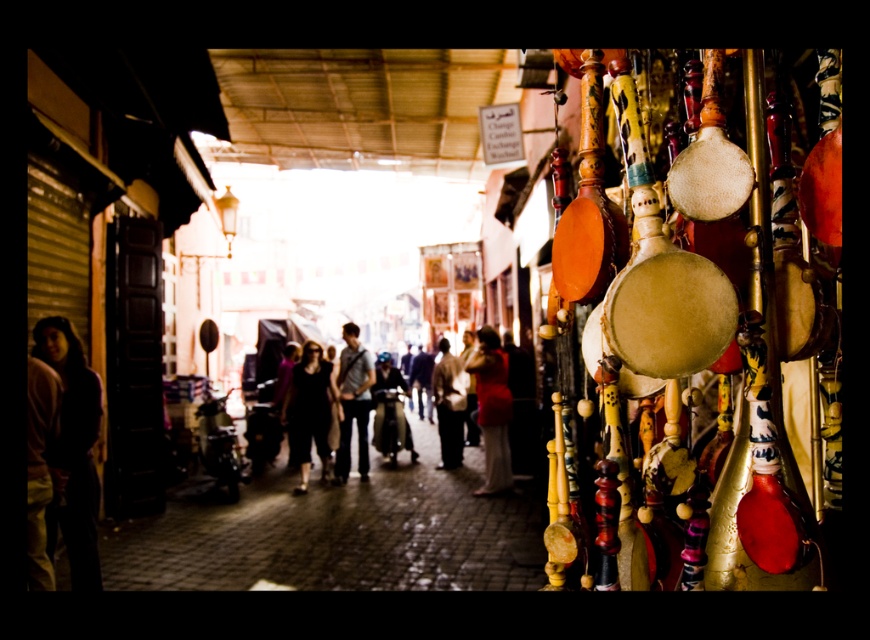
You are standing at the entrance of a market stall and want to reach a point that is 21.21 feet away. The point is marked as point (392, 579). Is this point located in the foreground or the midground of the scene?

The point (392, 579) is located in the midground of the scene because it is 21.21 feet away from the viewer, which places it beyond the foreground area where the musical instruments are displayed.

You are a customer in this market and you want to buy both the dark fabric pants at left and the dark matte clothing at center. Which item would you need to try on first if you want to check the size compatibility between them?

You should try on the dark fabric pants at left first since it has a smaller size compared to the dark matte clothing at center, allowing you to compare the fit between the two items.